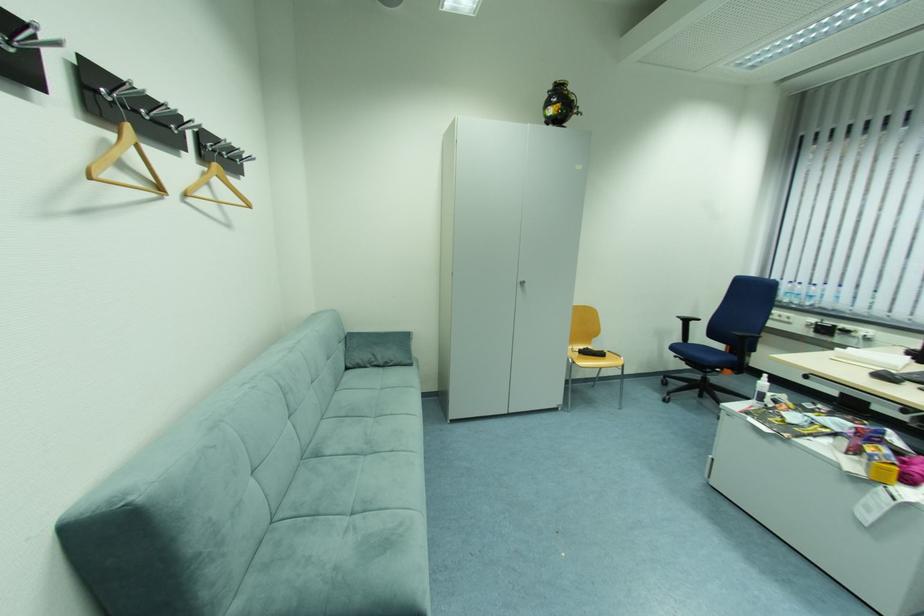
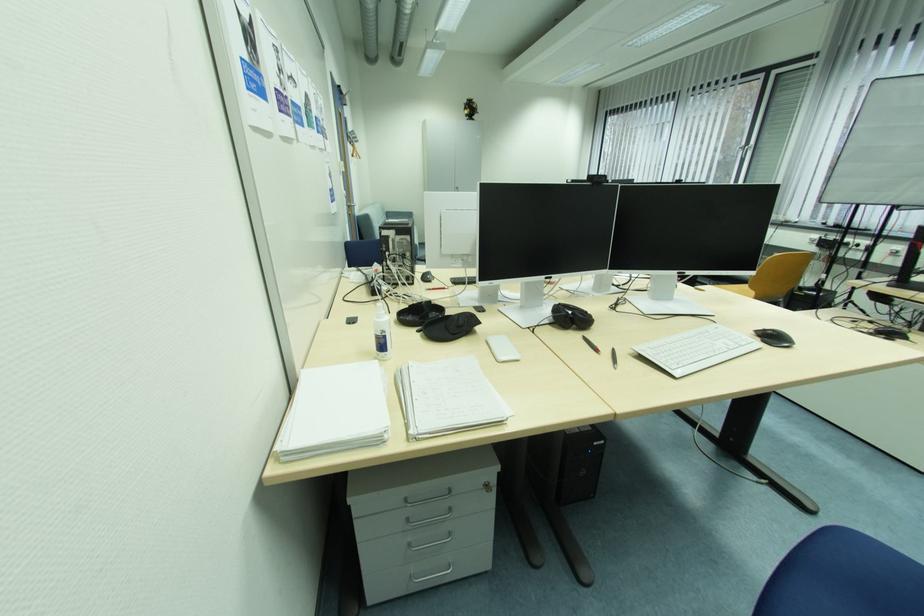
Question: I am providing you with two images of the same scene from different viewpoints. After the viewpoint changes to image2, which objects are now occluded?

Choices:
 (A) plastic water bottle
 (B) black headphones
 (C) orange cabinet handle
 (D) black and red pen

Answer: (A)